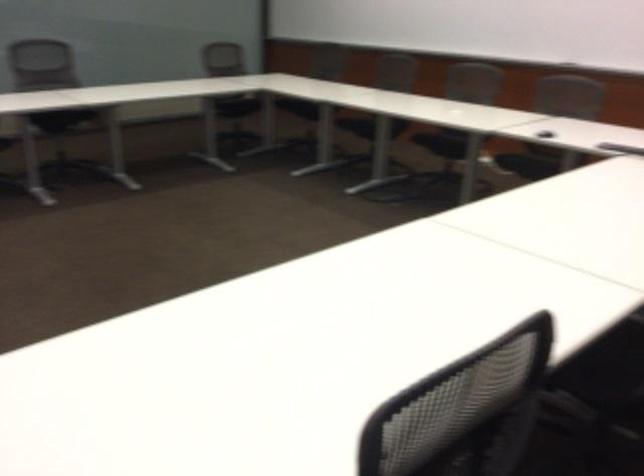
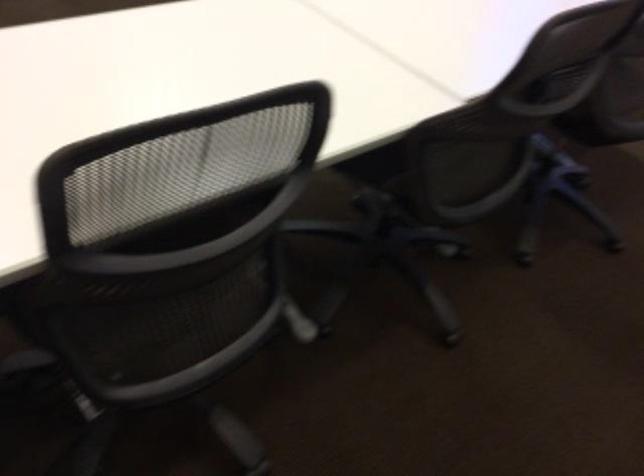
Question: Which direction would the cameraman need to move to produce the second image? Reply with the corresponding letter.

Choices:
 (A) Left
 (B) Right
 (C) Forward
 (D) Backward

Answer: (D)